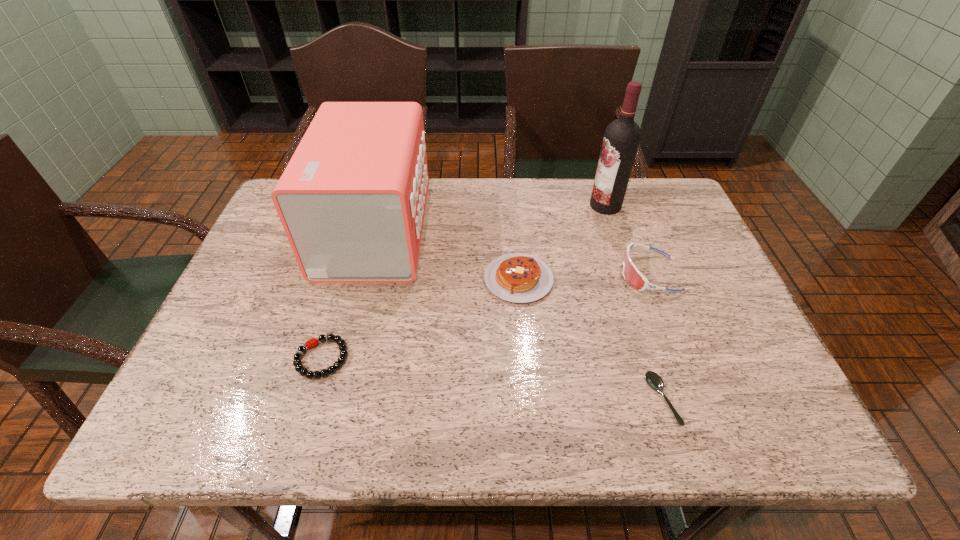
The image size is (960, 540). I want to click on object present at the left edge, so click(352, 199).

You are a GUI agent. You are given a task and a screenshot of the screen. Output one action in this format:
    pyautogui.click(x=<x>, y=<y>)
    Task: Click on the object positioned at the right edge
    
    Given the screenshot: What is the action you would take?
    pyautogui.click(x=632, y=275)

Locate an element on the screen. object that is at the far left corner is located at coordinates (352, 199).

The width and height of the screenshot is (960, 540). I want to click on vacant space at the far edge of the desktop, so click(563, 227).

Where is `free region at the near edge`? free region at the near edge is located at coordinates (272, 426).

Where is `free space at the left edge of the desktop`? free space at the left edge of the desktop is located at coordinates (254, 274).

This screenshot has width=960, height=540. I want to click on free space at the right edge of the desktop, so click(687, 230).

Locate an element on the screen. Image resolution: width=960 pixels, height=540 pixels. blank space at the far right corner is located at coordinates (663, 213).

Where is `vacant area that lies between the pancake and the third tallest object`? The width and height of the screenshot is (960, 540). vacant area that lies between the pancake and the third tallest object is located at coordinates (585, 277).

The width and height of the screenshot is (960, 540). I want to click on vacant point located between the second shortest object and the fourth tallest object, so click(x=420, y=319).